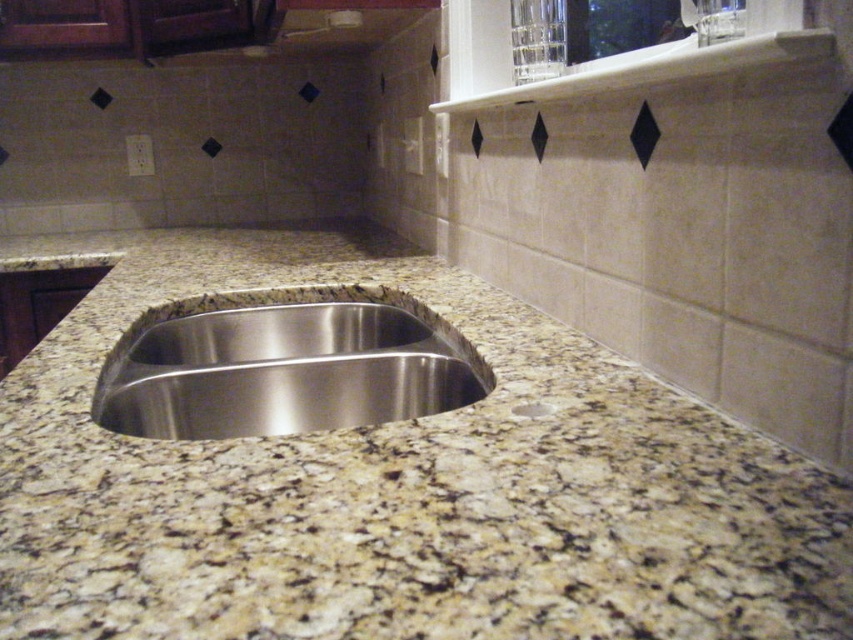
You are a plumber checking the kitchen sink. You need to know if the stainless steel sink at center is taller than the white marble drain at center to determine if water can flow properly. Can you confirm this?

The stainless steel sink at center is much taller than the white marble drain at center, so water may not flow properly as the drain is lower.

You are designing a kitchen layout and need to place a cutting board on the granite at center and a pot on the stainless steel sink at center. Which surface can accommodate a larger item?

The granite at center is bigger than the stainless steel sink at center, so the granite can accommodate a larger item.

Consider the image. You are arranging items on the kitchen countertop and need to place a cutting board between the granite at center and the white marble drain at center. Based on their positions, which object should the cutting board be placed closer to?

The cutting board should be placed closer to the white marble drain at center because the granite at center is located to the left of the drain, meaning the drain is to the right of the granite. Therefore, placing the cutting board between them would position it closer to the drain if placed on the right side of the granite.